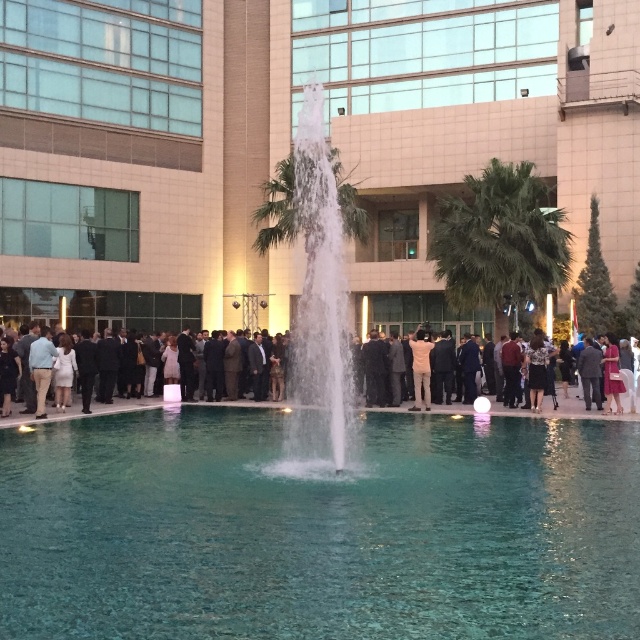
You are at an event and need to find a place to sit. The clear glass pool at center and the clear glass fountain at center are both nearby. Which one is smaller and thus might have more space around it for seating?

The clear glass pool at center is smaller than the clear glass fountain at center, so there might be more space around it for seating.

You are a photographer at the event and want to capture a photo of the clear glass pool at center without any people in the frame. Given that the formal attire group at center is blocking the view, can you adjust your position to take the shot?

The clear glass pool at center is thinner than the formal attire group at center, so you can move to the side of the pool where it is narrower to avoid the group blocking the view.

You are standing at the event and want to pour a drink into the clear glass pool at center. Do you think you can reach it without moving closer than 5 meters?

The clear glass pool at center is 5.19 meters away from the viewer. Since the distance is more than 5 meters, you cannot reach it without moving closer.